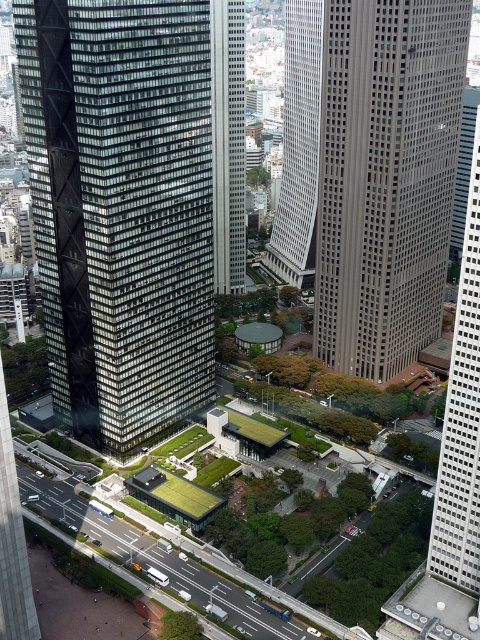
You are a drone operator whose drone has a maximum flight distance of 200 meters. You are instructed to fly your drone from your current position to the gray concrete skyscraper at center to capture aerial footage. Based on the scene description, can your drone safely reach the skyscraper without exceeding its maximum flight distance?

The gray concrete skyscraper at center is 201.69 meters away from camera. Since the drone has a maximum flight distance of 200 meters, it cannot safely reach the skyscraper without exceeding its limit.

You are standing on the observation deck of a nearby building and want to take a photo of the black glass skyscraper at center. If your camera has a maximum focus range of 150 meters, will you be able to capture it clearly?

The black glass skyscraper at center is 157.89 meters away from the viewer, which exceeds the camera maximum focus range of 150 meters. Therefore, the camera cannot focus on it clearly.